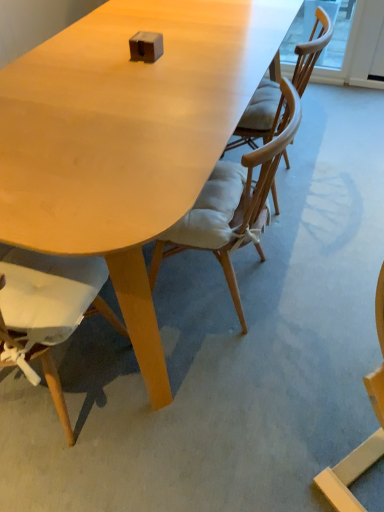
Identify the location of vacant space underneath matte wood chair at lower left, marked as the third chair in a right-to-left arrangement (from a real-world perspective). The width and height of the screenshot is (384, 512). (62, 375).